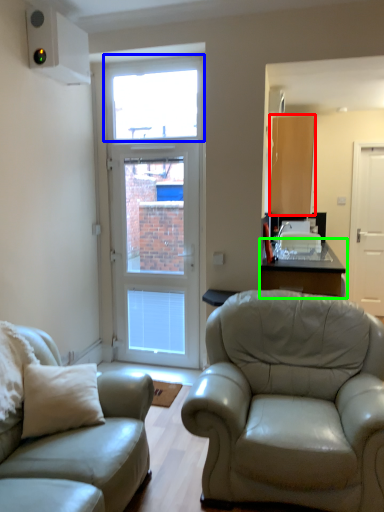
Question: Which object is the closest to the cabinetry (highlighted by a red box)? Choose among these: window (highlighted by a blue box) or table (highlighted by a green box).

Choices:
 (A) window
 (B) table

Answer: (B)